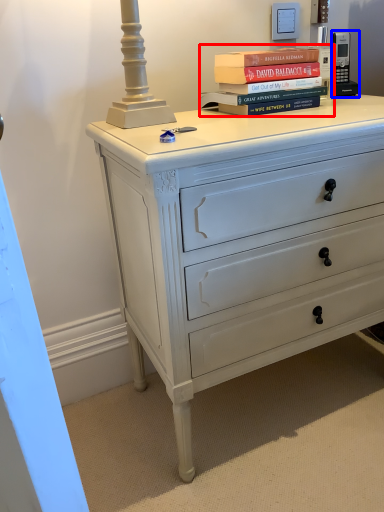
Question: Which of the following is the closest to the observer, book (highlighted by a red box) or gadget (highlighted by a blue box)?

Choices:
 (A) book
 (B) gadget

Answer: (A)